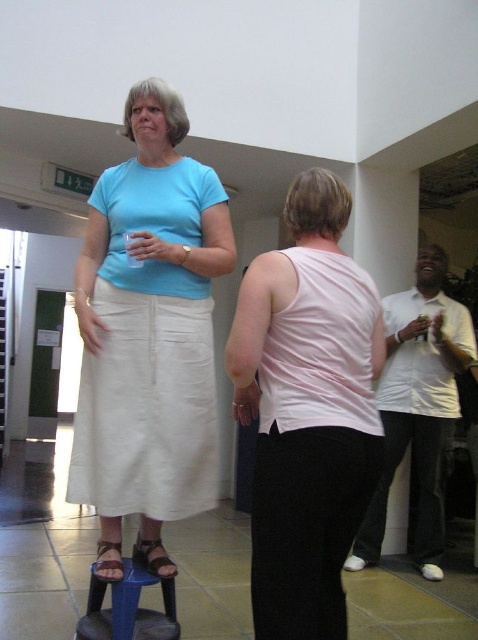
You are organizing a charity event and need to place a decorative ribbon on the pink fabric tank top at center and the white matte cup at right. Since the ribbon needs to be tied around the middle of each item, which item will require the ribbon to be placed higher up?

The pink fabric tank top at center is shorter than the white matte cup at right, so the ribbon should be placed higher on the pink fabric tank top at center to ensure it is at the middle of the item.